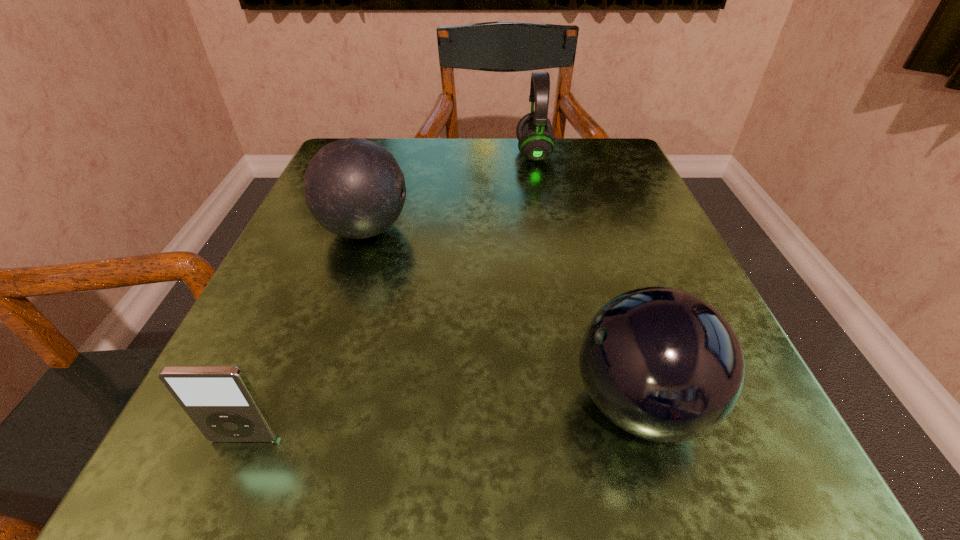
Identify the location of free space between the nearer bowling ball and the farther bowling ball. [x=502, y=317].

Locate an element on the screen. Image resolution: width=960 pixels, height=540 pixels. free space between the iPod and the left bowling ball is located at coordinates (304, 334).

Identify the location of free spot between the third nearest object and the right bowling ball. (502, 317).

Identify the location of free space between the farthest object and the farther bowling ball. The height and width of the screenshot is (540, 960). (449, 192).

Where is `free spot between the headset and the farther bowling ball`? The height and width of the screenshot is (540, 960). free spot between the headset and the farther bowling ball is located at coordinates (449, 192).

Where is `free space between the farther bowling ball and the farthest object`? The height and width of the screenshot is (540, 960). free space between the farther bowling ball and the farthest object is located at coordinates (449, 192).

What are the coordinates of `the second closest object to the nearer bowling ball` in the screenshot? It's located at (220, 400).

You are a GUI agent. You are given a task and a screenshot of the screen. Output one action in this format:
    pyautogui.click(x=<x>, y=<y>)
    Task: Click on the object that is the second closest to the second farthest object
    The width and height of the screenshot is (960, 540).
    Given the screenshot: What is the action you would take?
    (662, 364)

Locate an element on the screen. The width and height of the screenshot is (960, 540). vacant space that satisfies the following two spatial constraints: 1. on the side of the nearer bowling ball with the finger holes; 2. on the front-facing side of the shortest object is located at coordinates (650, 438).

Locate an element on the screen. This screenshot has height=540, width=960. free point that satisfies the following two spatial constraints: 1. on the side of the right bowling ball with the finger holes; 2. on the front-facing side of the iPod is located at coordinates (650, 438).